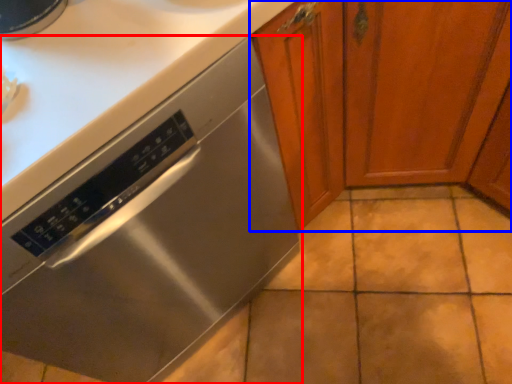
Question: Among these objects, which one is farthest to the camera, home appliance (highlighted by a red box) or cabinetry (highlighted by a blue box)?

Choices:
 (A) home appliance
 (B) cabinetry

Answer: (A)